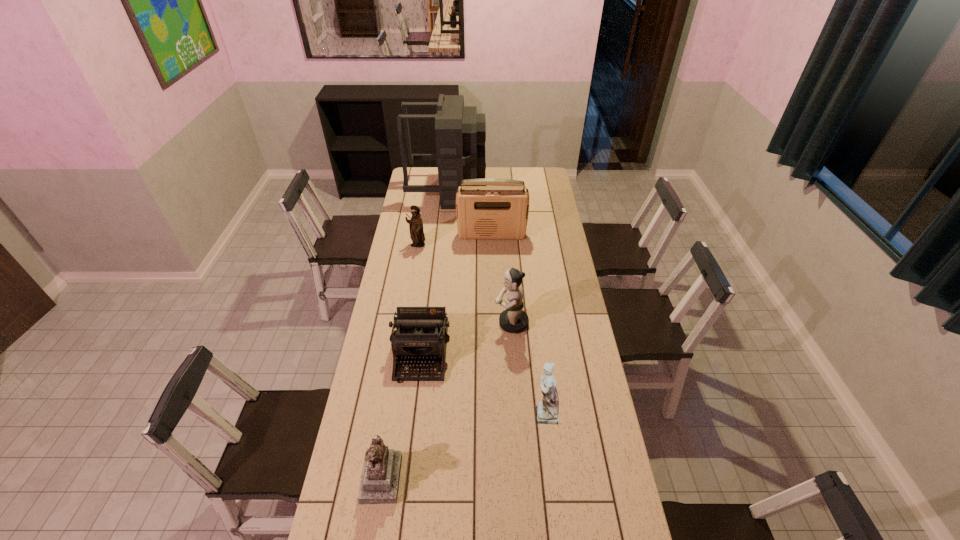
Identify the location of backpack. (460, 132).

This screenshot has width=960, height=540. I want to click on the tallest object, so click(x=460, y=132).

I want to click on radio receiver, so click(498, 210).

At what (x,y) coordinates should I click in order to perform the action: click on the third nearest figurine. Please return your answer as a coordinate pair (x, y). Looking at the image, I should click on (512, 320).

Locate an element on the screen. The width and height of the screenshot is (960, 540). the third farthest figurine is located at coordinates (547, 410).

The width and height of the screenshot is (960, 540). Find the location of `the farthest figurine`. the farthest figurine is located at coordinates (417, 236).

This screenshot has width=960, height=540. In order to click on the nearest figurine in this screenshot , I will do `click(379, 484)`.

Identify the location of the shortest object. This screenshot has width=960, height=540. (421, 335).

Identify the location of blank space located on the front compartment of the backpack. This screenshot has width=960, height=540. (508, 191).

You are a GUI agent. You are given a task and a screenshot of the screen. Output one action in this format:
    pyautogui.click(x=<x>, y=<y>)
    Task: Click on the blank area located 0.350m on the front-facing side of the radio receiver
    Image resolution: width=960 pixels, height=540 pixels.
    Given the screenshot: What is the action you would take?
    pyautogui.click(x=493, y=288)